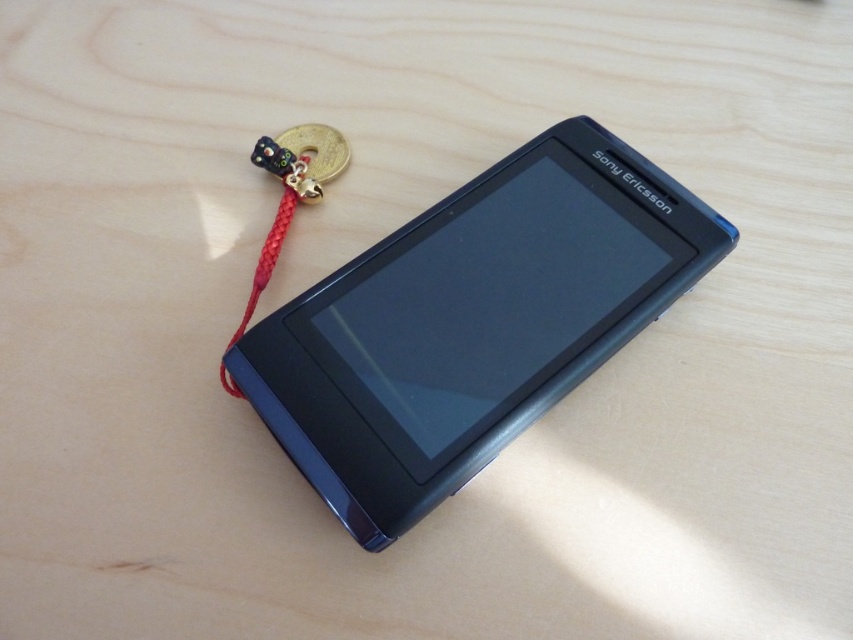
You are standing in front of a table with a slate gray plastic smartphone at center. If you were to draw a dot exactly where the smartphone is located on the table, what coordinates would you mark?

The 2D location of the slate gray plastic smartphone at center is at point (473, 323), so you would mark the dot at coordinates (473, 323).

You are standing in front of a table and see a Sony Ericsson mobile phone on it. There is a point marked at coordinates (473, 323). What object is located at that point?

The point at coordinates (473, 323) is occupied by the slate gray plastic smartphone at center.

You are organizing a desk and need to place the slate gray plastic smartphone at center and the red braided string at bottom left. Based on the scene, where should you place the smartphone relative to the string?

The slate gray plastic smartphone at center is positioned under the red braided string at bottom left, so you should place the smartphone directly below the string.